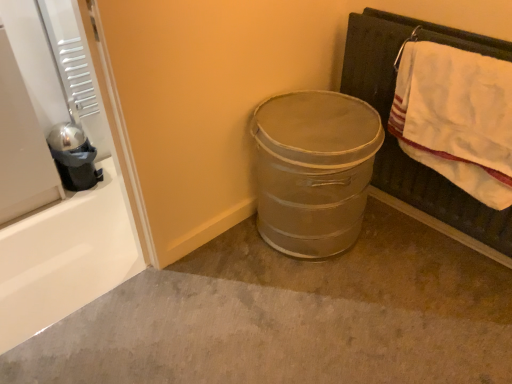
This screenshot has width=512, height=384. I want to click on free point to the right of metallic gray trash can at center, so click(410, 262).